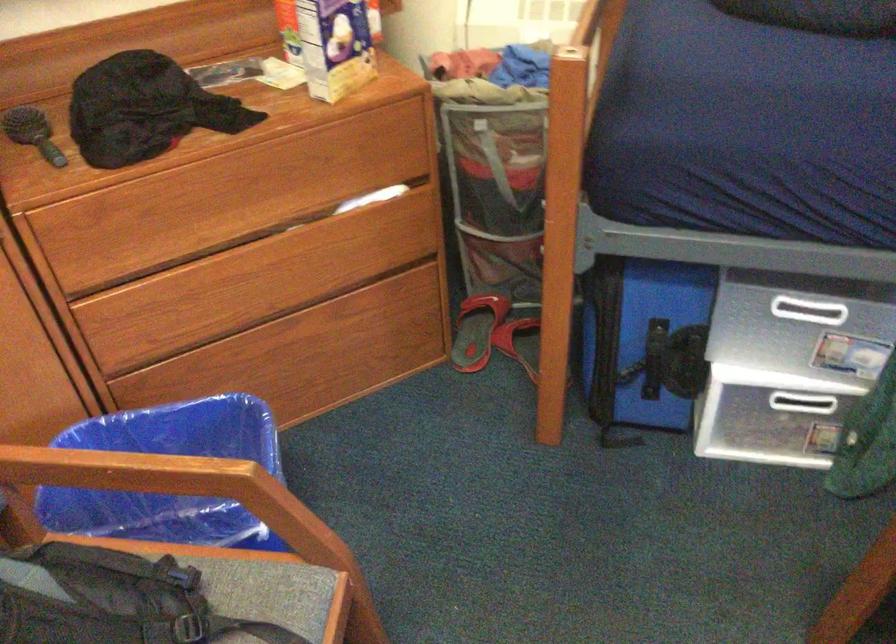
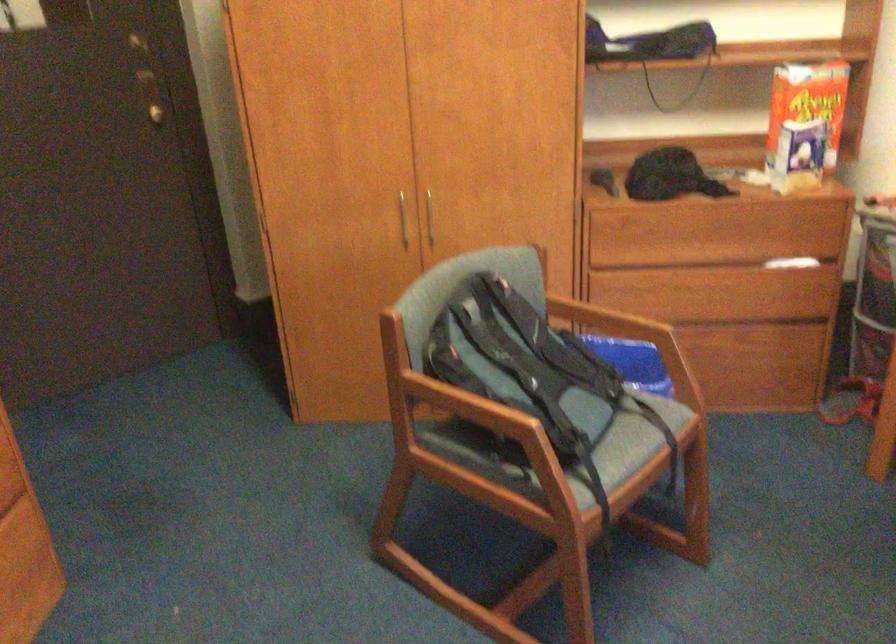
Question: The camera is either moving clockwise (left) or counter-clockwise (right) around the object. The first image is from the beginning of the video and the second image is from the end. Is the camera moving left or right when shooting the video?

Choices:
 (A) Left
 (B) Right

Answer: (B)